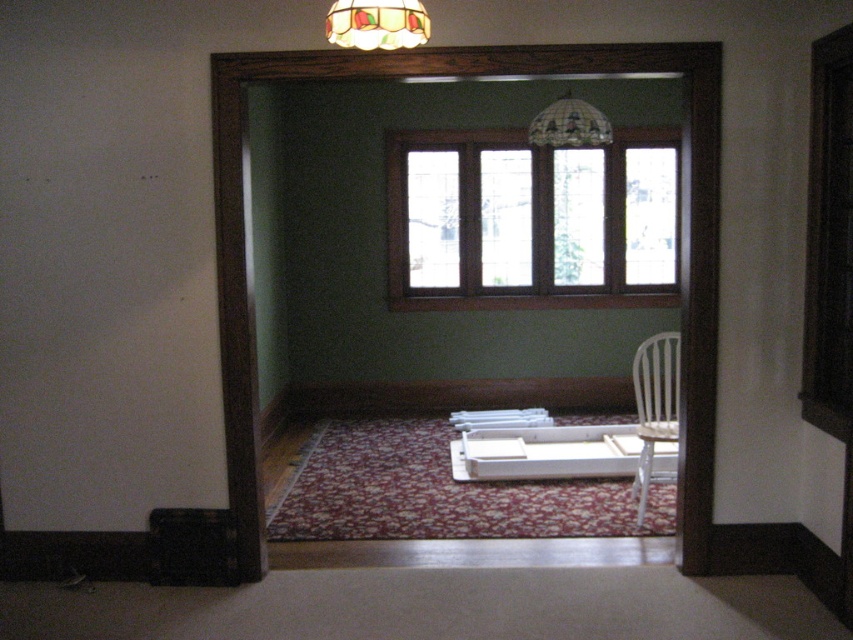
Can you confirm if clear glass window at center is smaller than stained glass dome at upper center?

Incorrect, clear glass window at center is not smaller in size than stained glass dome at upper center.

Which is below, clear glass window at center or stained glass dome at upper center?

clear glass window at center is lower down.

Who is more distant from viewer, [404,150] or [554,116]?

The point [404,150] is behind.

This screenshot has width=853, height=640. Find the location of `clear glass window at center`. clear glass window at center is located at coordinates (520, 227).

Measure the distance between white plastic chair at center and stained glass dome at upper center.

The distance of white plastic chair at center from stained glass dome at upper center is 6.20 feet.

Does point (654, 365) lie behind point (599, 122)?

That is False.

Locate an element on the screen. The image size is (853, 640). white plastic chair at center is located at coordinates (654, 408).

Where is `white plastic chair at center`? white plastic chair at center is located at coordinates (654, 408).

Who is higher up, white plastic chair at center or stained glass lampshade at upper center?

stained glass lampshade at upper center is higher up.

Locate an element on the screen. This screenshot has height=640, width=853. white plastic chair at center is located at coordinates (654, 408).

Which is behind, point (651, 436) or point (393, 26)?

Point (651, 436)

I want to click on white plastic chair at center, so click(654, 408).